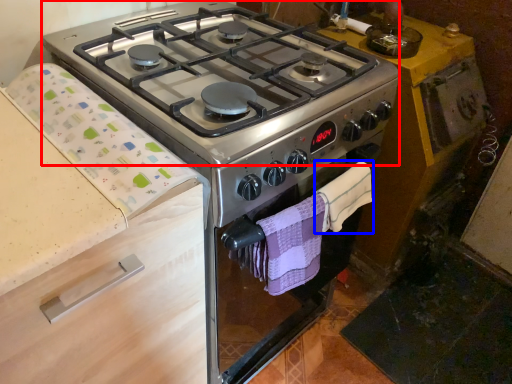
Question: Among these objects, which one is farthest to the camera, gas stove (highlighted by a red box) or hand towel (highlighted by a blue box)?

Choices:
 (A) gas stove
 (B) hand towel

Answer: (B)